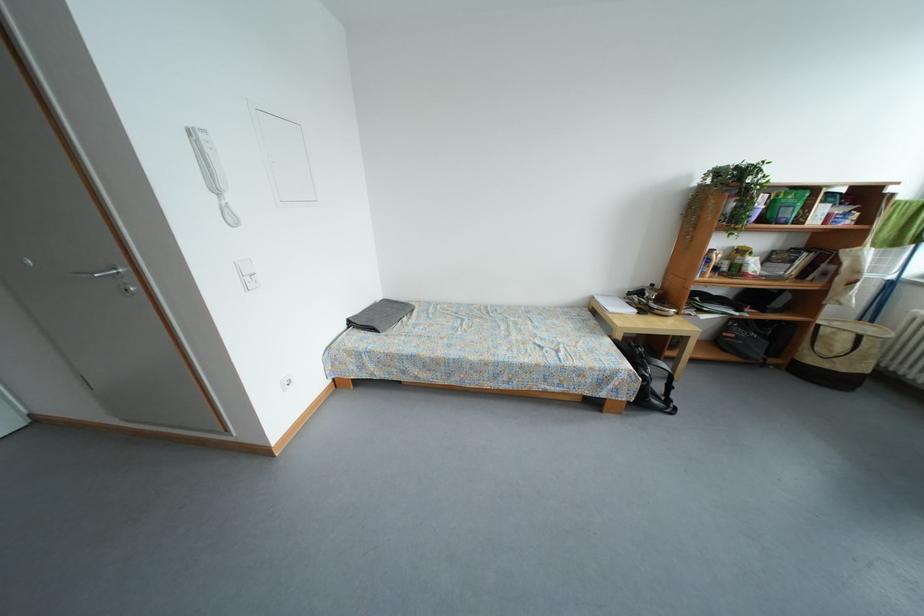
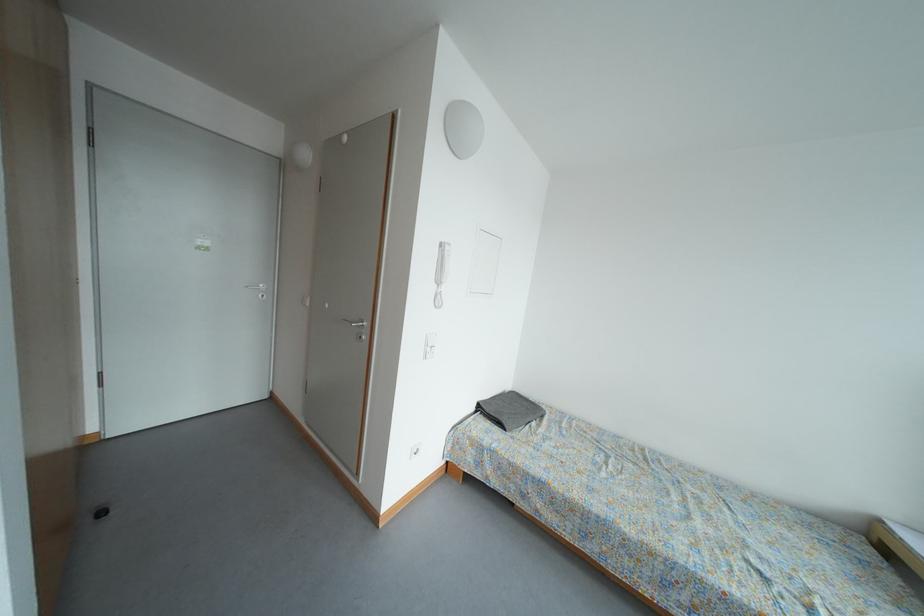
Locate, in the second image, the point that corresponds to (196,130) in the first image.

(450, 246)